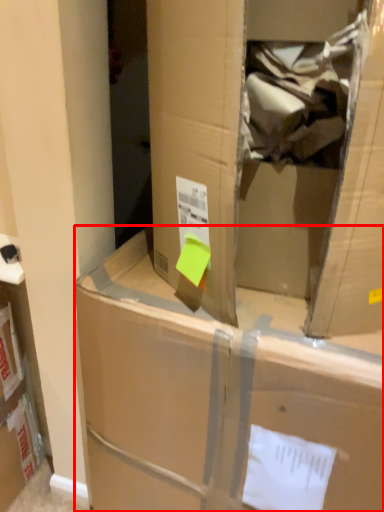
Question: From the image's perspective, where is box (annotated by the red box) located relative to cardboard box?

Choices:
 (A) above
 (B) below

Answer: (B)